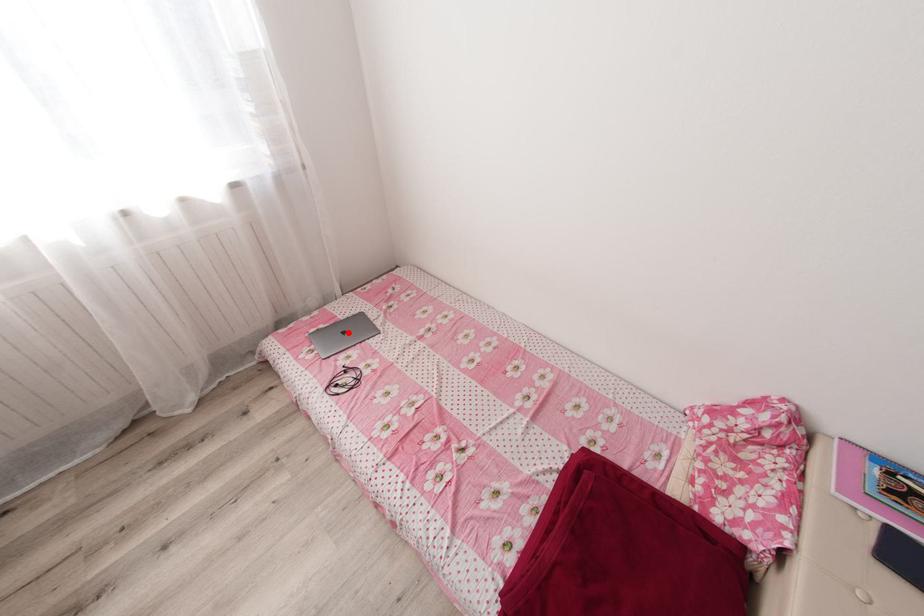
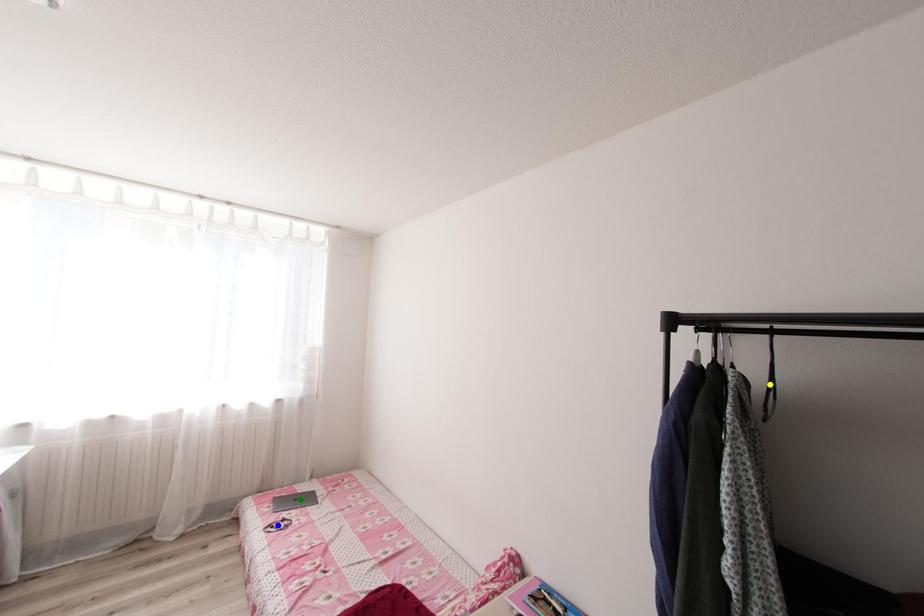
Question: I am providing you with two images of the same scene from different viewpoints. A red point is marked on the first image. You are given multiple points on the second image. Which spot in image 2 lines up with the point in image 1?

Choices:
 (A) yellow point
 (B) blue point
 (C) green point

Answer: (C)